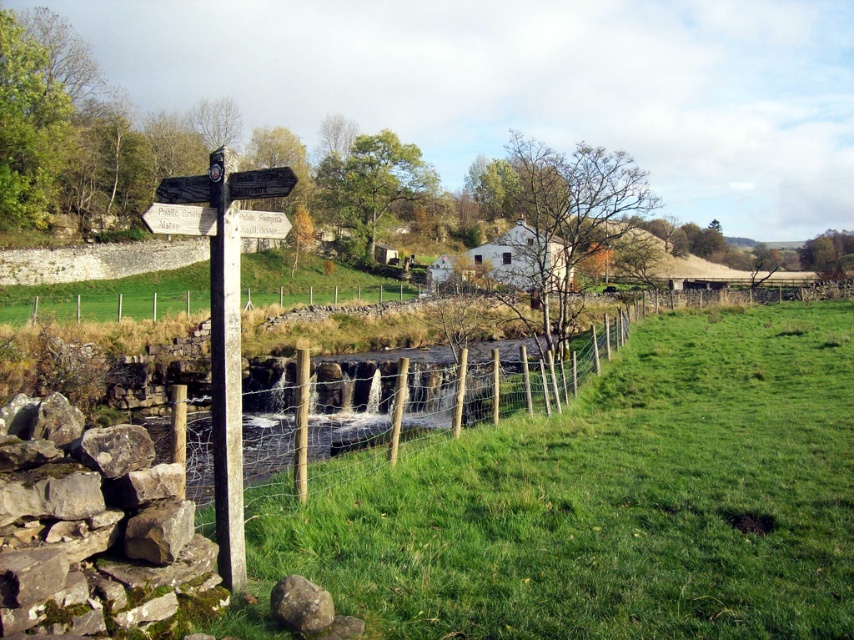
You are a hiker who wants to cross from the stone wall to the grassy field. The mossy stone wall at lower left and the wire mesh fence at center are in your way. Which obstacle should you climb over first?

The mossy stone wall at lower left is positioned over the wire mesh fence at center, so you should climb over the mossy stone wall at lower left first as it is above the fence and closer to you.

You are a hiker trying to cross the wire mesh fence at center. The white wooden signpost at left has a warning sign stating that the fence must not be crossed. Can you see the signpost from your current position near the fence?

The wire mesh fence at center is positioned under the white wooden signpost at left, meaning the signpost is above the fence. Since the sign is on the signpost above the fence, you can see the warning sign on the white wooden signpost at left from your position near the fence.

You are a hiker who wants to take a photo of the white wooden signpost at left from the other side of the wire mesh fence at center. Since the fence is wider than the signpost, will you be able to see the entire signpost through the fence without moving your camera?

The wire mesh fence at center is wider than the white wooden signpost at left, so yes, you can see the entire signpost through the fence without moving your camera because the fence spans a larger area, allowing the signpost to be fully visible within its width.